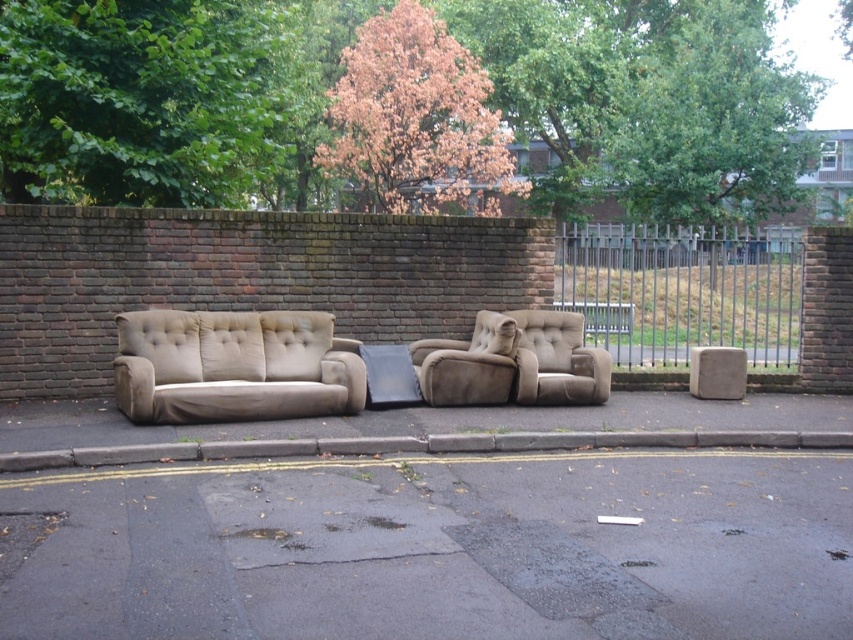
At what (x,y) coordinates should I click in order to perform the action: click on beige fabric daybed at center. Please return your answer as a coordinate pair (x, y). The image size is (853, 640). Looking at the image, I should click on (343, 365).

Does beige fabric daybed at center appear over metallic silver fence at right?

No.

The image size is (853, 640). Identify the location of beige fabric daybed at center. (343, 365).

Measure the distance between dark gray asphalt at lower center and camera.

dark gray asphalt at lower center is 3.97 meters away from camera.

Is point (624, 595) positioned before point (585, 284)?

That is True.

Is point (729, 524) closer to viewer compared to point (751, 278)?

Yes, point (729, 524) is closer to viewer.

This screenshot has width=853, height=640. I want to click on dark gray asphalt at lower center, so click(444, 548).

Which is below, metallic silver fence at right or beige fabric armchair at center?

Positioned lower is beige fabric armchair at center.

Consider the image. Is metallic silver fence at right bigger than beige fabric armchair at center?

Yes, metallic silver fence at right is bigger than beige fabric armchair at center.

Where is `metallic silver fence at right`? The width and height of the screenshot is (853, 640). metallic silver fence at right is located at coordinates (682, 291).